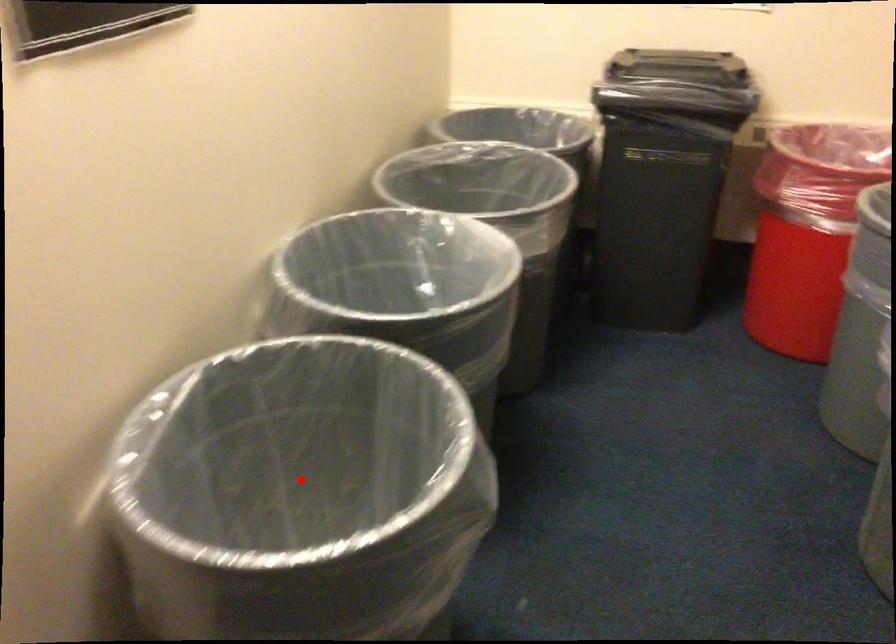
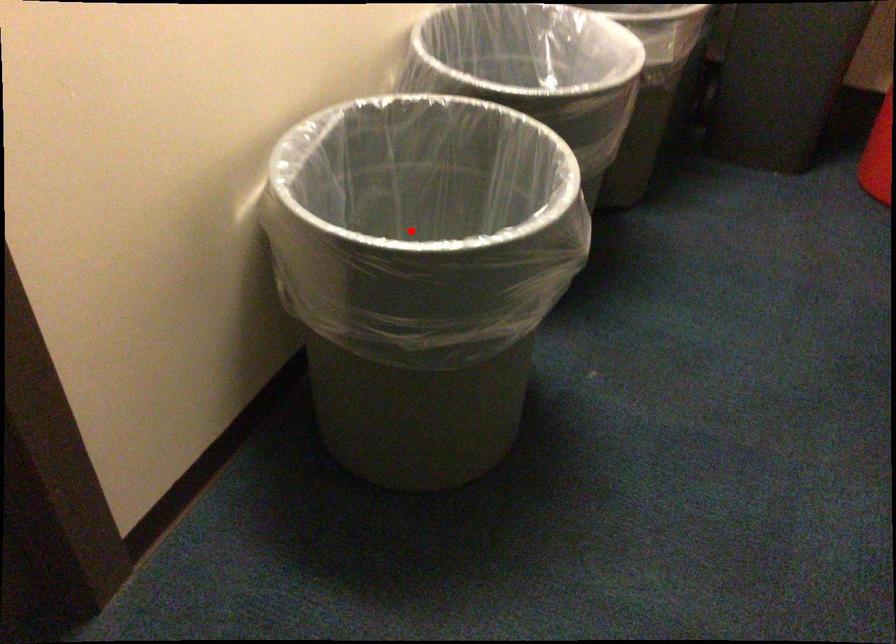
I am providing you with two images of the same scene from different viewpoints. A red point is marked on the first image and another point is marked on the second image. Do the highlighted points in image1 and image2 indicate the same real-world spot?

Yes